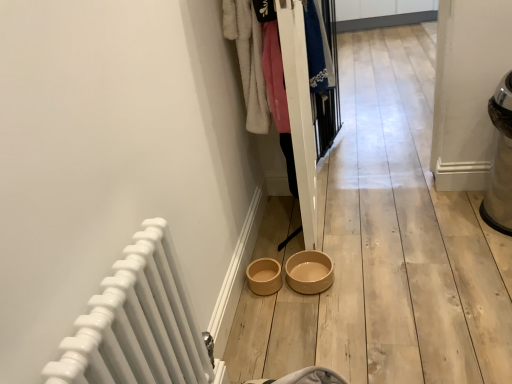
Question: Are white fluffy coat at upper center, which ranks as the second clothing in back-to-front order, and white glossy radiator at lower left far apart?

Choices:
 (A) no
 (B) yes

Answer: (B)

Question: Does white fluffy coat at upper center, which ranks as the second clothing in back-to-front order, have a smaller size compared to white glossy radiator at lower left?

Choices:
 (A) yes
 (B) no

Answer: (B)

Question: Is white fluffy coat at upper center, the first clothing positioned from the front, to the right of white glossy radiator at lower left from the viewer's perspective?

Choices:
 (A) no
 (B) yes

Answer: (B)

Question: Is white fluffy coat at upper center, placed as the first clothing when sorted from left to right, facing away from white glossy radiator at lower left?

Choices:
 (A) no
 (B) yes

Answer: (A)

Question: From a real-world perspective, is white fluffy coat at upper center, the first clothing positioned from the front, positioned over white glossy radiator at lower left based on gravity?

Choices:
 (A) no
 (B) yes

Answer: (B)

Question: Is white fluffy coat at upper center, which ranks as the second clothing in back-to-front order, thinner than white glossy radiator at lower left?

Choices:
 (A) yes
 (B) no

Answer: (B)

Question: Is white glossy radiator at lower left at the right side of white fluffy coat at upper center, which ranks as the second clothing in back-to-front order?

Choices:
 (A) yes
 (B) no

Answer: (B)

Question: Is white glossy radiator at lower left touching white fluffy coat at upper center, placed as the first clothing when sorted from left to right?

Choices:
 (A) yes
 (B) no

Answer: (B)

Question: Is white glossy radiator at lower left far from white fluffy coat at upper center, placed as the first clothing when sorted from left to right?

Choices:
 (A) yes
 (B) no

Answer: (A)

Question: Does white glossy radiator at lower left have a smaller size compared to white fluffy coat at upper center, placed as the first clothing when sorted from left to right?

Choices:
 (A) no
 (B) yes

Answer: (B)

Question: Can you confirm if white glossy radiator at lower left is shorter than white fluffy coat at upper center, which ranks as the second clothing in back-to-front order?

Choices:
 (A) yes
 (B) no

Answer: (B)

Question: Is white glossy radiator at lower left outside of white fluffy coat at upper center, acting as the 2th clothing starting from the right?

Choices:
 (A) yes
 (B) no

Answer: (A)

Question: Is blue cotton shirt at center, the 2th clothing positioned from the left, further to camera compared to white glossy radiator at lower left?

Choices:
 (A) yes
 (B) no

Answer: (A)